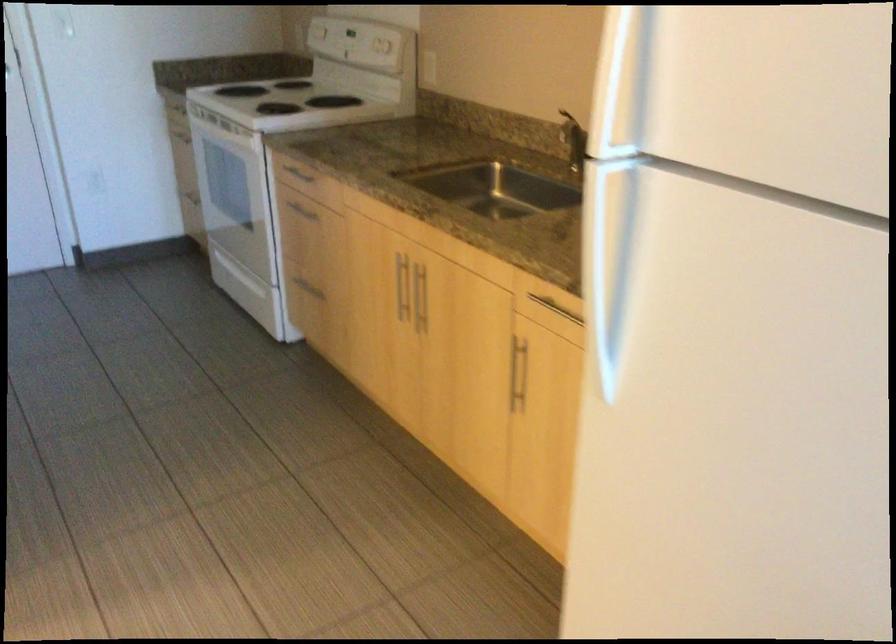
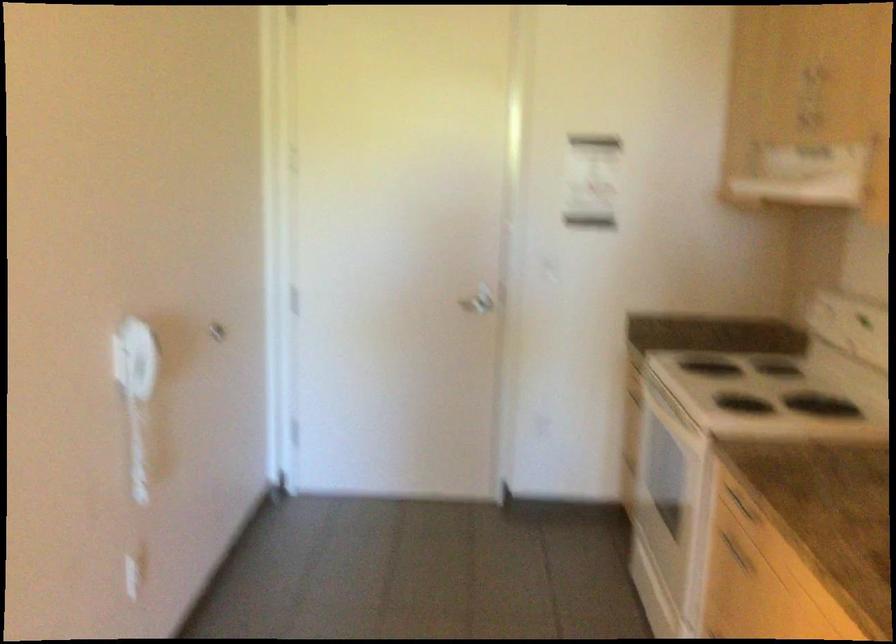
Where in the second image is the point corresponding to [297,216] from the first image?

(735, 552)